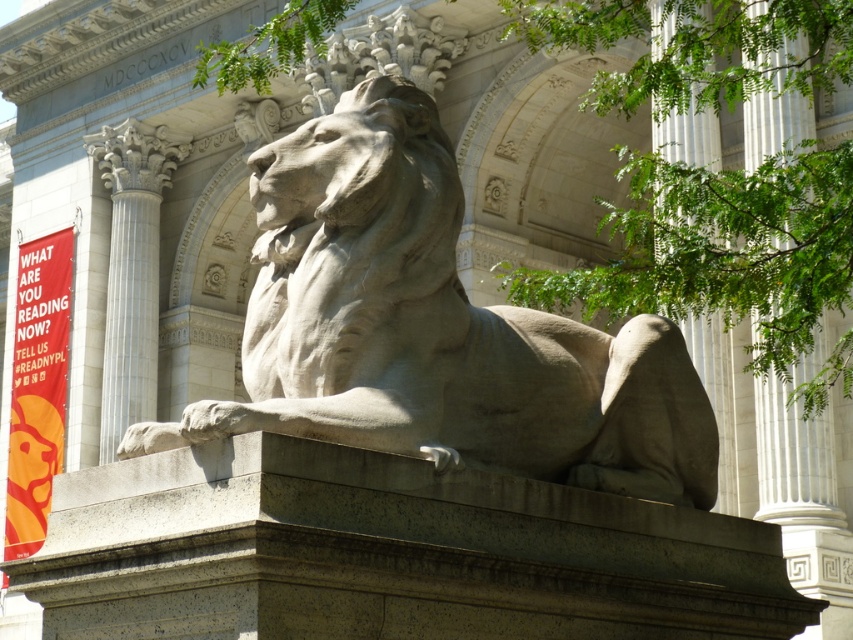
Question: Which object is farther from the camera taking this photo?

Choices:
 (A) gray stone lion at center
 (B) white marble column at center

Answer: (B)

Question: Is white marble column at center to the right of gray stone paw at lower left from the viewer's perspective?

Choices:
 (A) yes
 (B) no

Answer: (B)

Question: Which is nearer to the gray stone lion at center?

Choices:
 (A) gray stone paw at lower left
 (B) white marble column at center

Answer: (A)

Question: Which is farther from the gray stone lion at center?

Choices:
 (A) white marble column at center
 (B) gray stone paw at lower left

Answer: (A)

Question: Does gray stone lion at center lie in front of white marble column at center?

Choices:
 (A) no
 (B) yes

Answer: (B)

Question: Is white marble column at center to the left of gray stone paw at lower left from the viewer's perspective?

Choices:
 (A) yes
 (B) no

Answer: (A)